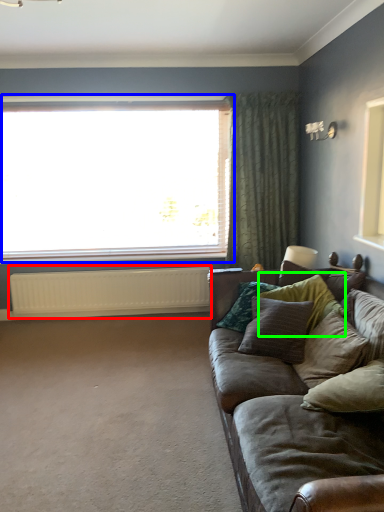
Question: Which object is the closest to the radiator (highlighted by a red box)? Choose among these: window (highlighted by a blue box) or pillow (highlighted by a green box).

Choices:
 (A) window
 (B) pillow

Answer: (A)